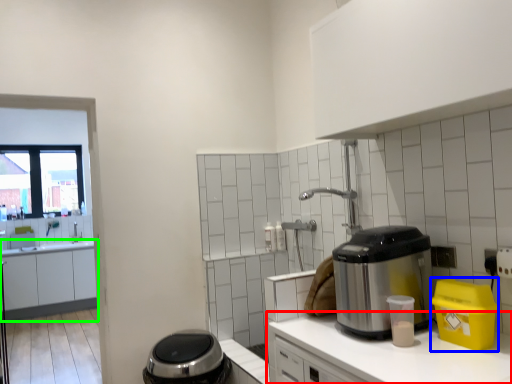
Question: Which is nearer to the countertop (highlighted by a red box)? appliance (highlighted by a blue box) or cabinetry (highlighted by a green box).

Choices:
 (A) appliance
 (B) cabinetry

Answer: (A)